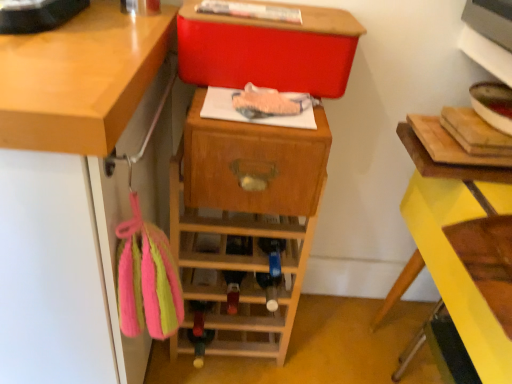
Question: In terms of width, does wooden wine rack at center look wider or thinner when compared to matte red storage box at upper center?

Choices:
 (A) thin
 (B) wide

Answer: (B)

Question: From a real-world perspective, is wooden wine rack at center above or below matte red storage box at upper center?

Choices:
 (A) below
 (B) above

Answer: (A)

Question: Which is nearer to the matte red storage box at upper center?

Choices:
 (A) wooden drawer at center
 (B) yellow painted wood at right
 (C) wooden wine rack at center

Answer: (A)

Question: Which object is positioned closest to the wooden drawer at center?

Choices:
 (A) wooden wine rack at center
 (B) yellow painted wood at right
 (C) matte red storage box at upper center

Answer: (A)